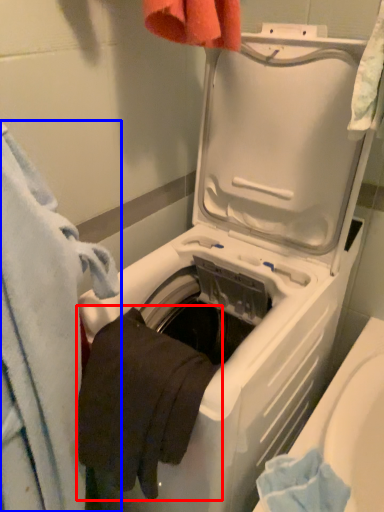
Question: Among these objects, which one is nearest to the camera, bath towel (highlighted by a red box) or towel (highlighted by a blue box)?

Choices:
 (A) bath towel
 (B) towel

Answer: (B)